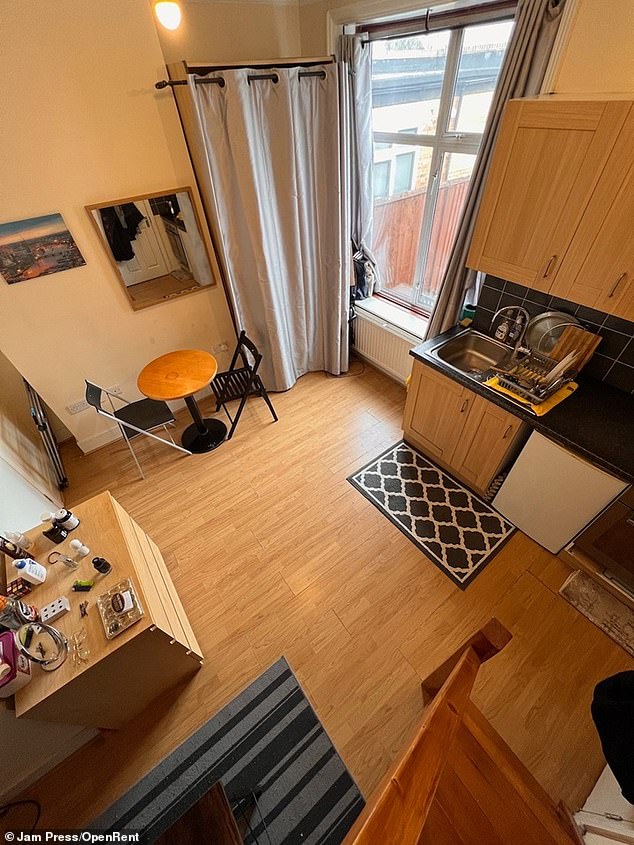
Where is `chair`? This screenshot has height=845, width=634. chair is located at coordinates (125, 423), (231, 389).